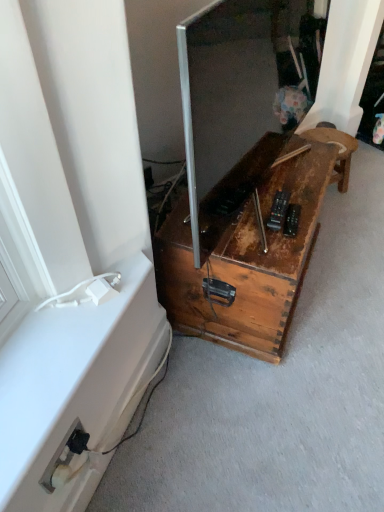
How much space does rusty wood trunk at lower right, the 1th furniture in the left-to-right sequence, occupy horizontally?

54.32 centimeters.

Image resolution: width=384 pixels, height=512 pixels. Describe the element at coordinates (244, 249) in the screenshot. I see `rusty wood trunk at lower right, the 1th furniture in the left-to-right sequence` at that location.

From the picture: What is the approximate height of rusty wood stool at center, placed as the second furniture when sorted from left to right?

rusty wood stool at center, placed as the second furniture when sorted from left to right, is 24.47 centimeters in height.

What do you see at coordinates (230, 87) in the screenshot? I see `metallic silver screen at center` at bounding box center [230, 87].

What is the approximate height of metallic silver screen at center?

metallic silver screen at center is 23.90 inches in height.

Where is `rusty wood trunk at lower right, the 1th furniture in the left-to-right sequence`? Image resolution: width=384 pixels, height=512 pixels. rusty wood trunk at lower right, the 1th furniture in the left-to-right sequence is located at coordinates (244, 249).

There is a metallic silver screen at center. Where is `the 1st furniture below it (from a real-world perspective)`? the 1st furniture below it (from a real-world perspective) is located at coordinates click(244, 249).

Considering the positions of objects rusty wood trunk at lower right, marked as the 2th furniture in a right-to-left arrangement, and metallic silver screen at center in the image provided, who is more to the left, rusty wood trunk at lower right, marked as the 2th furniture in a right-to-left arrangement, or metallic silver screen at center?

rusty wood trunk at lower right, marked as the 2th furniture in a right-to-left arrangement, is more to the left.

From the image's perspective, does rusty wood trunk at lower right, marked as the 2th furniture in a right-to-left arrangement, appear higher than metallic silver screen at center?

No, from the image's perspective, rusty wood trunk at lower right, marked as the 2th furniture in a right-to-left arrangement, is not over metallic silver screen at center.

Looking at this image, visually, is rusty wood trunk at lower right, the 1th furniture in the left-to-right sequence, positioned to the left or to the right of rusty wood stool at center, placed as the second furniture when sorted from left to right?

Clearly, rusty wood trunk at lower right, the 1th furniture in the left-to-right sequence, is on the left of rusty wood stool at center, placed as the second furniture when sorted from left to right, in the image.

What's the angular difference between rusty wood trunk at lower right, the 1th furniture in the left-to-right sequence, and rusty wood stool at center, which is counted as the first furniture, starting from the right,'s facing directions?

The angular difference between rusty wood trunk at lower right, the 1th furniture in the left-to-right sequence, and rusty wood stool at center, which is counted as the first furniture, starting from the right, is 32.8 degrees.

What are the coordinates of `furniture above the rusty wood trunk at lower right, marked as the 2th furniture in a right-to-left arrangement (from the image's perspective)` in the screenshot? It's located at (338, 150).

Measure the distance from rusty wood trunk at lower right, marked as the 2th furniture in a right-to-left arrangement, to rusty wood stool at center, placed as the second furniture when sorted from left to right.

The distance of rusty wood trunk at lower right, marked as the 2th furniture in a right-to-left arrangement, from rusty wood stool at center, placed as the second furniture when sorted from left to right, is 65.76 centimeters.

What's the angular difference between white plastic electrical outlet at lower left and metallic silver screen at center's facing directions?

4.6 degrees.

Which object is further away from the camera taking this photo, white plastic electrical outlet at lower left or metallic silver screen at center?

white plastic electrical outlet at lower left is behind.

Looking at this image, considering the relative sizes of white plastic electrical outlet at lower left and metallic silver screen at center in the image provided, is white plastic electrical outlet at lower left wider than metallic silver screen at center?

No, white plastic electrical outlet at lower left is not wider than metallic silver screen at center.

From the image's perspective, between white plastic electrical outlet at lower left and metallic silver screen at center, who is located below?

white plastic electrical outlet at lower left appears lower in the image.

Would you say metallic silver screen at center contains rusty wood trunk at lower right, marked as the 2th furniture in a right-to-left arrangement?

No, rusty wood trunk at lower right, marked as the 2th furniture in a right-to-left arrangement, is not inside metallic silver screen at center.

Image resolution: width=384 pixels, height=512 pixels. In the image, there is a metallic silver screen at center. In order to click on furniture below it (from the image's perspective) in this screenshot , I will do `click(244, 249)`.

From the image's perspective, is metallic silver screen at center on top of rusty wood trunk at lower right, the 1th furniture in the left-to-right sequence?

Correct, metallic silver screen at center appears higher than rusty wood trunk at lower right, the 1th furniture in the left-to-right sequence, in the image.

Is metallic silver screen at center thinner than rusty wood trunk at lower right, the 1th furniture in the left-to-right sequence?

Indeed, metallic silver screen at center has a lesser width compared to rusty wood trunk at lower right, the 1th furniture in the left-to-right sequence.

Is rusty wood stool at center, which is counted as the first furniture, starting from the right, directly adjacent to rusty wood trunk at lower right, marked as the 2th furniture in a right-to-left arrangement?

No.

Considering the relative positions of rusty wood stool at center, which is counted as the first furniture, starting from the right, and rusty wood trunk at lower right, marked as the 2th furniture in a right-to-left arrangement, in the image provided, is rusty wood stool at center, which is counted as the first furniture, starting from the right, to the left or to the right of rusty wood trunk at lower right, marked as the 2th furniture in a right-to-left arrangement,?

rusty wood stool at center, which is counted as the first furniture, starting from the right, is positioned on rusty wood trunk at lower right, marked as the 2th furniture in a right-to-left arrangement,'s right side.

Who is smaller, rusty wood stool at center, placed as the second furniture when sorted from left to right, or rusty wood trunk at lower right, the 1th furniture in the left-to-right sequence?

Smaller between the two is rusty wood stool at center, placed as the second furniture when sorted from left to right.

Considering the points (352, 149) and (49, 485), which point is in front, point (352, 149) or point (49, 485)?

The point (49, 485) is closer to the camera.

Relative to white plastic electrical outlet at lower left, is rusty wood stool at center, placed as the second furniture when sorted from left to right, in front or behind?

In the image, rusty wood stool at center, placed as the second furniture when sorted from left to right, appears behind white plastic electrical outlet at lower left.

In terms of height, does rusty wood stool at center, which is counted as the first furniture, starting from the right, look taller or shorter compared to white plastic electrical outlet at lower left?

In the image, rusty wood stool at center, which is counted as the first furniture, starting from the right, appears to be taller than white plastic electrical outlet at lower left.

From the image's perspective, which one is positioned higher, metallic silver screen at center or rusty wood stool at center, placed as the second furniture when sorted from left to right?

rusty wood stool at center, placed as the second furniture when sorted from left to right, appears higher in the image.

Are metallic silver screen at center and rusty wood stool at center, placed as the second furniture when sorted from left to right, beside each other?

metallic silver screen at center and rusty wood stool at center, placed as the second furniture when sorted from left to right, are clearly separated.

Does metallic silver screen at center appear on the right side of rusty wood stool at center, placed as the second furniture when sorted from left to right?

Incorrect, metallic silver screen at center is not on the right side of rusty wood stool at center, placed as the second furniture when sorted from left to right.

Consider the image. Is metallic silver screen at center aimed at rusty wood stool at center, which is counted as the first furniture, starting from the right?

No.

Where is `window screen in front of the rusty wood trunk at lower right, the 1th furniture in the left-to-right sequence`? window screen in front of the rusty wood trunk at lower right, the 1th furniture in the left-to-right sequence is located at coordinates (230, 87).

At what (x,y) coordinates should I click in order to perform the action: click on furniture below the rusty wood trunk at lower right, marked as the 2th furniture in a right-to-left arrangement (from a real-world perspective). Please return your answer as a coordinate pair (x, y). Image resolution: width=384 pixels, height=512 pixels. Looking at the image, I should click on (338, 150).

From the image, which object appears to be nearer to metallic silver screen at center, rusty wood stool at center, placed as the second furniture when sorted from left to right, or white plastic electrical outlet at lower left?

rusty wood stool at center, placed as the second furniture when sorted from left to right, lies closer to metallic silver screen at center than the other object.

Considering their positions, is rusty wood stool at center, placed as the second furniture when sorted from left to right, positioned further to white plastic electrical outlet at lower left than rusty wood trunk at lower right, marked as the 2th furniture in a right-to-left arrangement?

The object further to white plastic electrical outlet at lower left is rusty wood stool at center, placed as the second furniture when sorted from left to right.

When comparing their distances from rusty wood stool at center, placed as the second furniture when sorted from left to right, does metallic silver screen at center or white plastic electrical outlet at lower left seem closer?

Among the two, metallic silver screen at center is located nearer to rusty wood stool at center, placed as the second furniture when sorted from left to right.

Based on their spatial positions, is rusty wood stool at center, placed as the second furniture when sorted from left to right, or rusty wood trunk at lower right, marked as the 2th furniture in a right-to-left arrangement, closer to metallic silver screen at center?

rusty wood trunk at lower right, marked as the 2th furniture in a right-to-left arrangement, lies closer to metallic silver screen at center than the other object.

Considering their positions, is metallic silver screen at center positioned closer to white plastic electrical outlet at lower left than rusty wood stool at center, which is counted as the first furniture, starting from the right?

The object closer to white plastic electrical outlet at lower left is metallic silver screen at center.

Based on their spatial positions, is rusty wood trunk at lower right, the 1th furniture in the left-to-right sequence, or metallic silver screen at center further from white plastic electrical outlet at lower left?

Based on the image, metallic silver screen at center appears to be further to white plastic electrical outlet at lower left.

Based on their spatial positions, is metallic silver screen at center or white plastic electrical outlet at lower left closer to rusty wood trunk at lower right, the 1th furniture in the left-to-right sequence?

metallic silver screen at center is positioned closer to the anchor rusty wood trunk at lower right, the 1th furniture in the left-to-right sequence.

Estimate the real-world distances between objects in this image. Which object is closer to rusty wood stool at center, which is counted as the first furniture, starting from the right, white plastic electrical outlet at lower left or rusty wood trunk at lower right, marked as the 2th furniture in a right-to-left arrangement?

rusty wood trunk at lower right, marked as the 2th furniture in a right-to-left arrangement.

What are the coordinates of `furniture positioned between metallic silver screen at center and rusty wood stool at center, placed as the second furniture when sorted from left to right, from near to far` in the screenshot? It's located at (244, 249).

Identify the location of electric outlet between metallic silver screen at center and rusty wood stool at center, placed as the second furniture when sorted from left to right, in the front-back direction. This screenshot has height=512, width=384. (58, 457).

Find the location of a particular element. Image resolution: width=384 pixels, height=512 pixels. furniture between metallic silver screen at center and white plastic electrical outlet at lower left in the vertical direction is located at coordinates (244, 249).

You are a GUI agent. You are given a task and a screenshot of the screen. Output one action in this format:
    pyautogui.click(x=<x>, y=<y>)
    Task: Click on the furniture located between white plastic electrical outlet at lower left and rusty wood stool at center, which is counted as the first furniture, starting from the right, in the depth direction
    
    Given the screenshot: What is the action you would take?
    pyautogui.click(x=244, y=249)